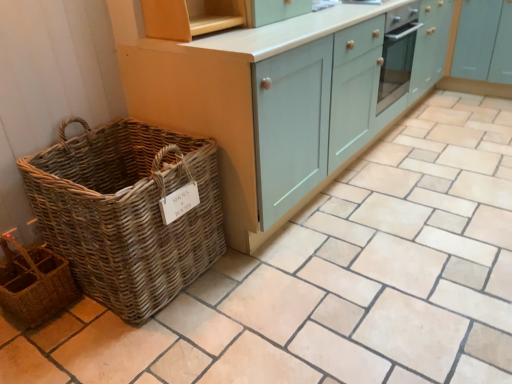
This screenshot has height=384, width=512. I want to click on empty space that is to the right of woven brown basket at left, so click(267, 284).